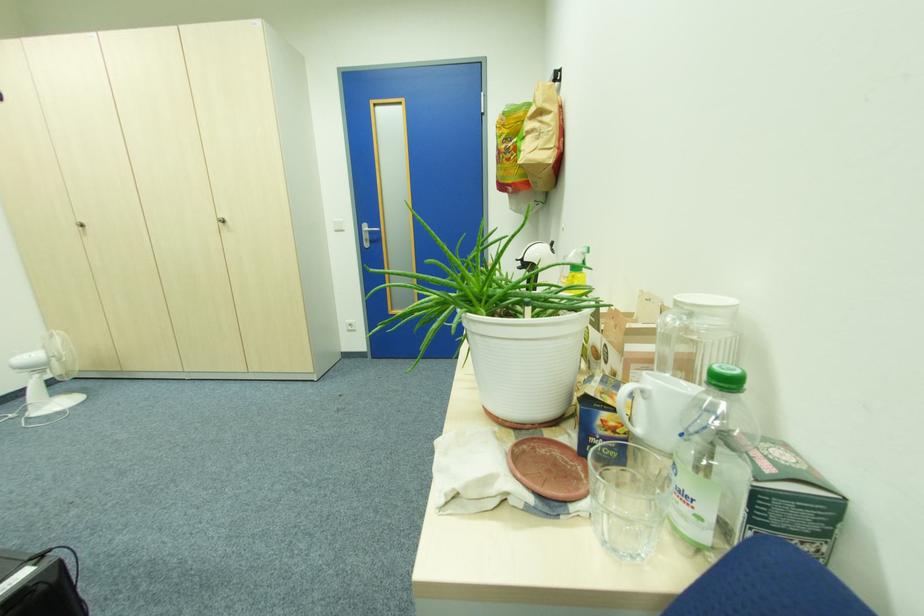
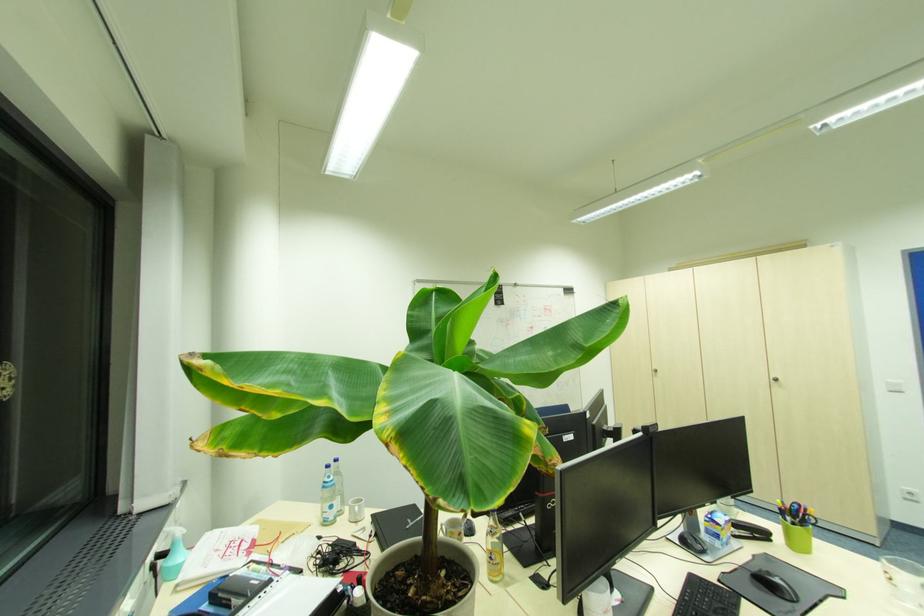
The point at (79,230) is marked in the first image. Where is the corresponding point in the second image?

(654, 374)